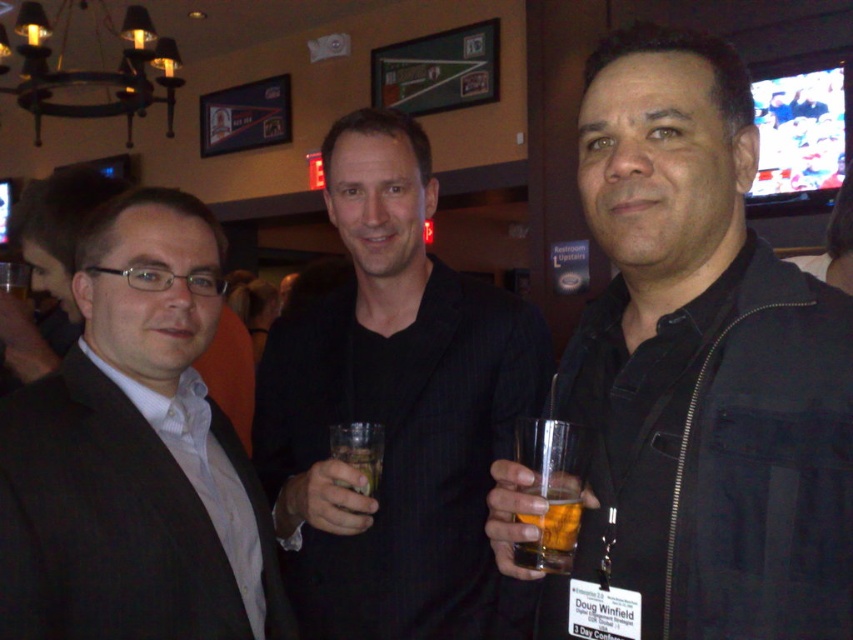
You are at a bar and want to move from the point at the bottom right corner to the point near the top left corner. Is the path clear between point (782, 284) and point (572, 547)?

Point (782, 284) is in front of point (572, 547), so the path between them is clear.

You are at a bar and want to grab the translucent glass at right. Where exactly should you look to find it?

The translucent glass at right is located at point (550,525).

You are standing at the point marked by the coordinates point (560, 513) in the image. The bar counter is located 30.17 inches away from you. Can you reach the bar counter from your current position without moving?

The distance between you and the bar counter is 30.17 inches, so you can reach the bar counter from your current position without moving as it is within arm reach.